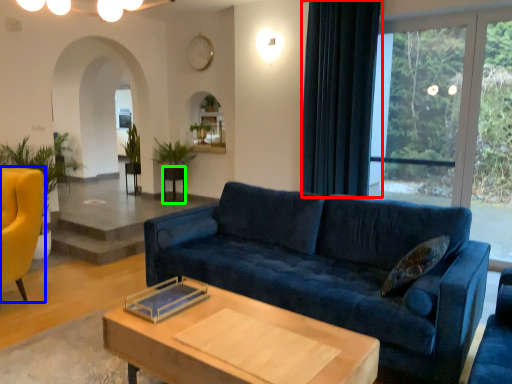
Question: Estimate the real-world distances between objects in this image. Which object is closer to curtain (highlighted by a red box), chair (highlighted by a blue box) or side table (highlighted by a green box)?

Choices:
 (A) chair
 (B) side table

Answer: (B)